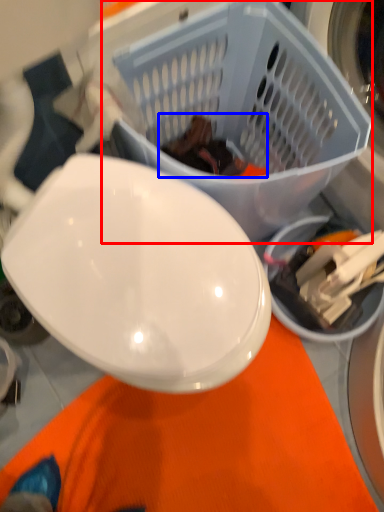
Question: Which object appears closest to the camera in this image, basket (highlighted by a red box) or food (highlighted by a blue box)?

Choices:
 (A) basket
 (B) food

Answer: (A)